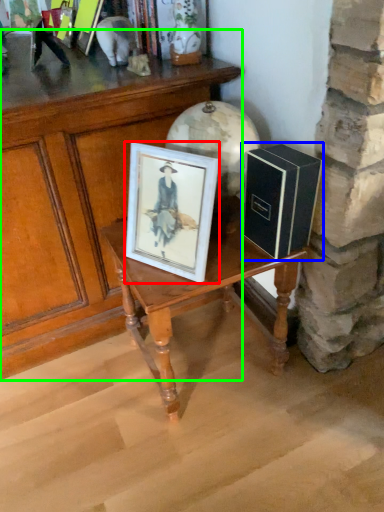
Question: Which object is positioned closest to picture frame (highlighted by a red box)? Select from book (highlighted by a blue box) and table (highlighted by a green box).

Choices:
 (A) book
 (B) table

Answer: (A)